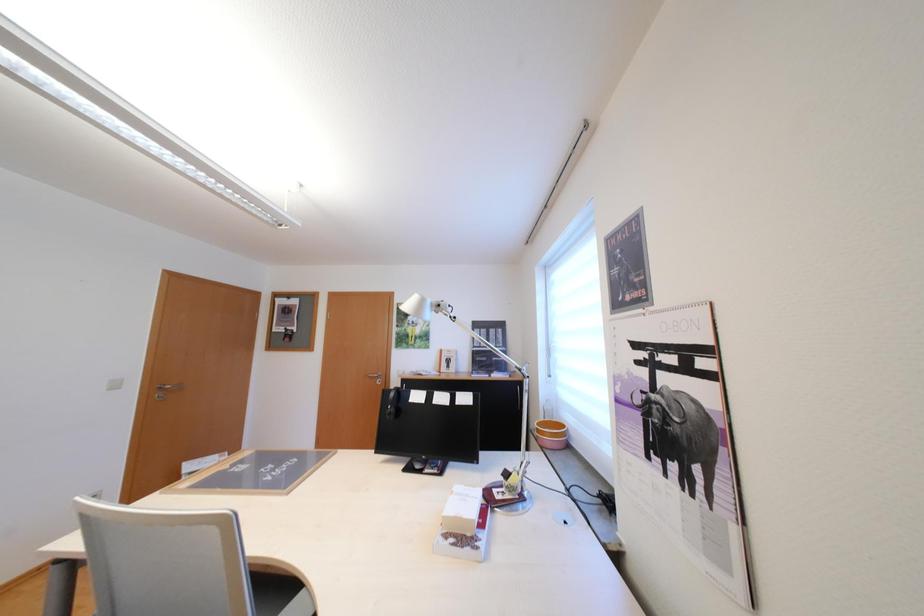
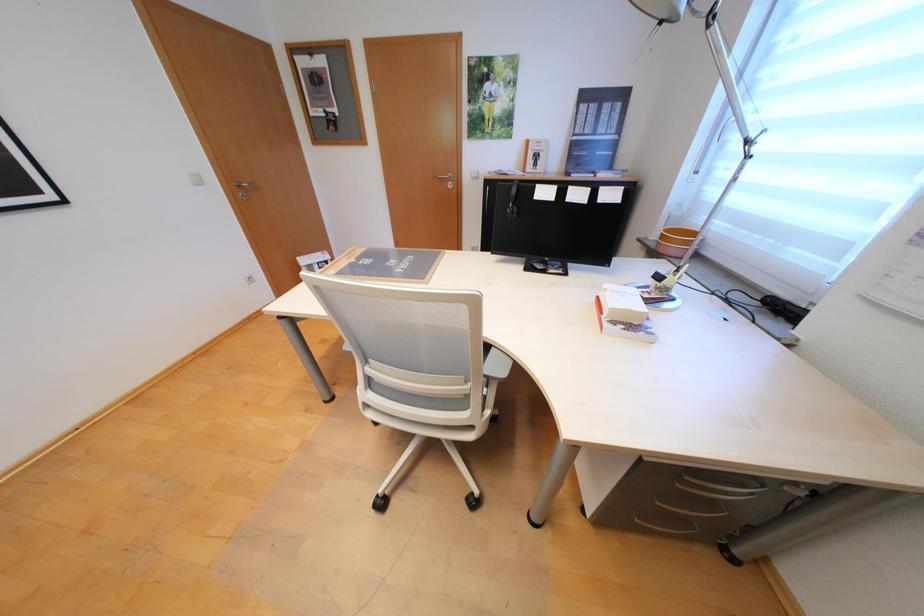
Question: The first image is from the beginning of the video and the second image is from the end. How did the camera likely rotate when shooting the video?

Choices:
 (A) Left
 (B) Right
 (C) Up
 (D) Down

Answer: (D)